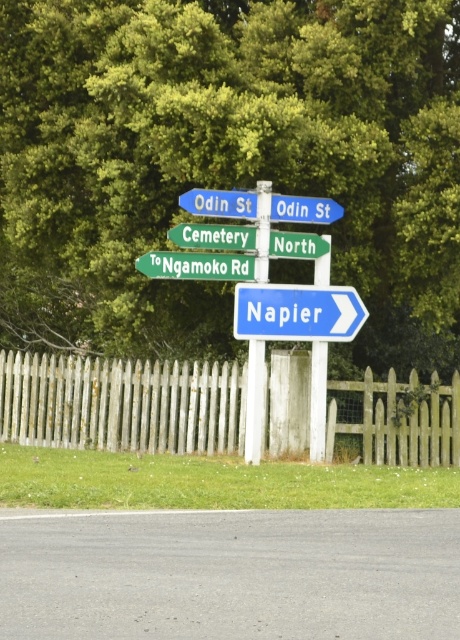
Does blue plastic sign at center right appear over green plastic sign at upper center?

Actually, blue plastic sign at center right is below green plastic sign at upper center.

Does point (345, 296) come behind point (233, 257)?

Yes, point (345, 296) is behind point (233, 257).

At what (x,y) coordinates should I click in order to perform the action: click on blue plastic sign at center right. Please return your answer as a coordinate pair (x, y). The width and height of the screenshot is (460, 640). Looking at the image, I should click on (297, 312).

The height and width of the screenshot is (640, 460). What do you see at coordinates (297, 312) in the screenshot?
I see `blue plastic sign at center right` at bounding box center [297, 312].

Does blue plastic sign at center right lie behind green plastic sign at center?

Yes, blue plastic sign at center right is further from the viewer.

This screenshot has height=640, width=460. In order to click on blue plastic sign at center right in this screenshot , I will do `click(297, 312)`.

Find the location of a particular element. blue plastic sign at center right is located at coordinates (297, 312).

Can you confirm if white wooden fence at lower center is smaller than green plastic sign at center?

Incorrect, white wooden fence at lower center is not smaller in size than green plastic sign at center.

Which is more to the left, white wooden fence at lower center or green plastic sign at center?

white wooden fence at lower center is more to the left.

What do you see at coordinates (121, 403) in the screenshot? The width and height of the screenshot is (460, 640). I see `white wooden fence at lower center` at bounding box center [121, 403].

Identify the location of white wooden fence at lower center. (121, 403).